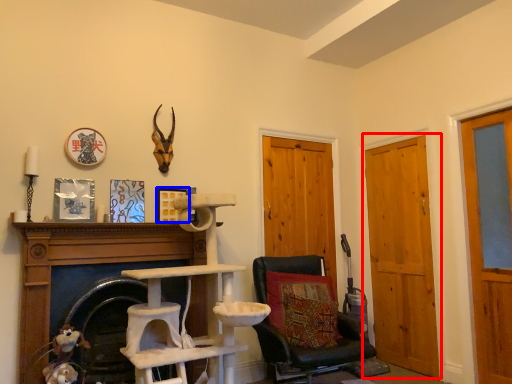
Question: Which of the following is the closest to the observer, door (highlighted by a red box) or picture frame (highlighted by a blue box)?

Choices:
 (A) door
 (B) picture frame

Answer: (B)